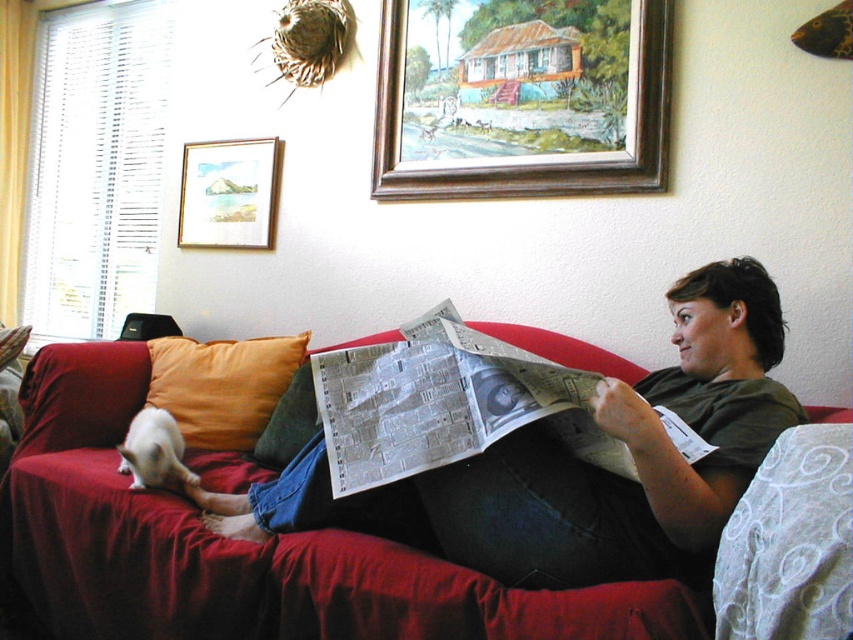
You are a delivery robot that needs to place a package on the couch. The package is 3 feet wide. You see the white glossy newspaper at center and the orange fabric pillow at left. Can you place the package between them without moving any items?

The distance between the white glossy newspaper at center and the orange fabric pillow at left is 3.31 feet. Since the package is 3 feet wide, it can fit between them as the space is slightly larger than the package.